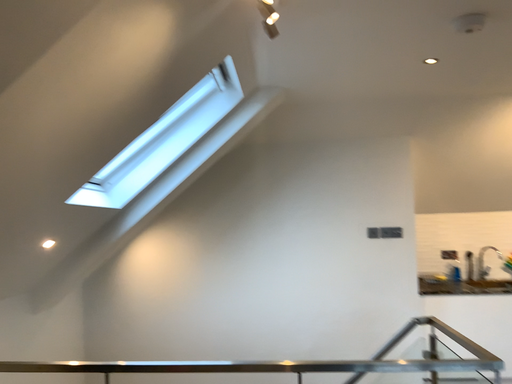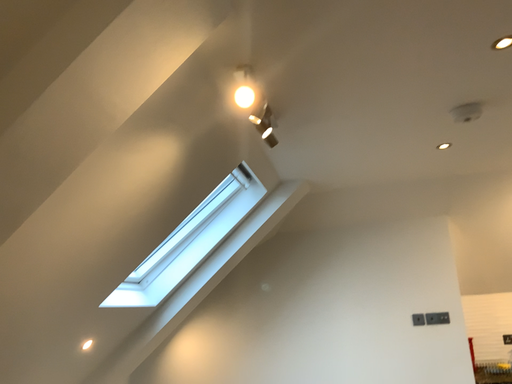
Question: Which way did the camera rotate in the video?

Choices:
 (A) rotated left
 (B) rotated right

Answer: (A)